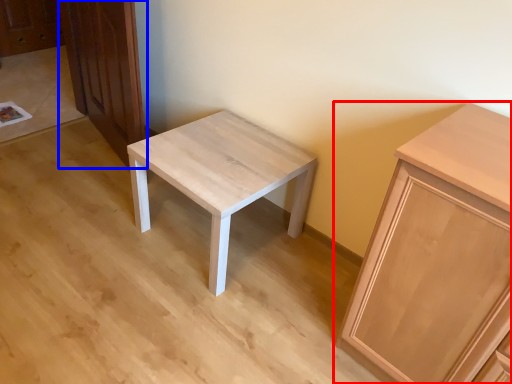
Question: Which object is closer to the camera taking this photo, cabinetry (highlighted by a red box) or dresser (highlighted by a blue box)?

Choices:
 (A) cabinetry
 (B) dresser

Answer: (A)